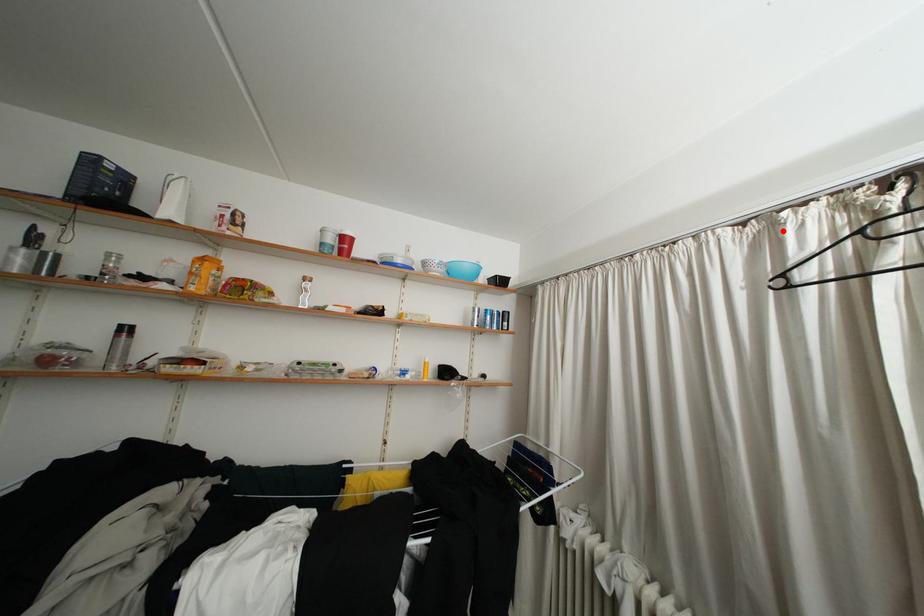
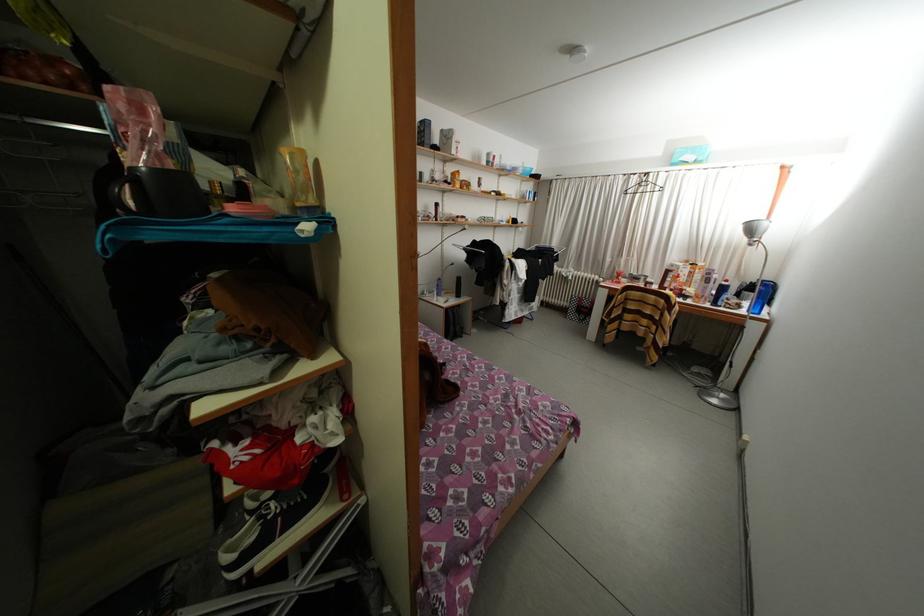
The point at the highlighted location is marked in the first image. Where is the corresponding point in the second image?

(638, 184)